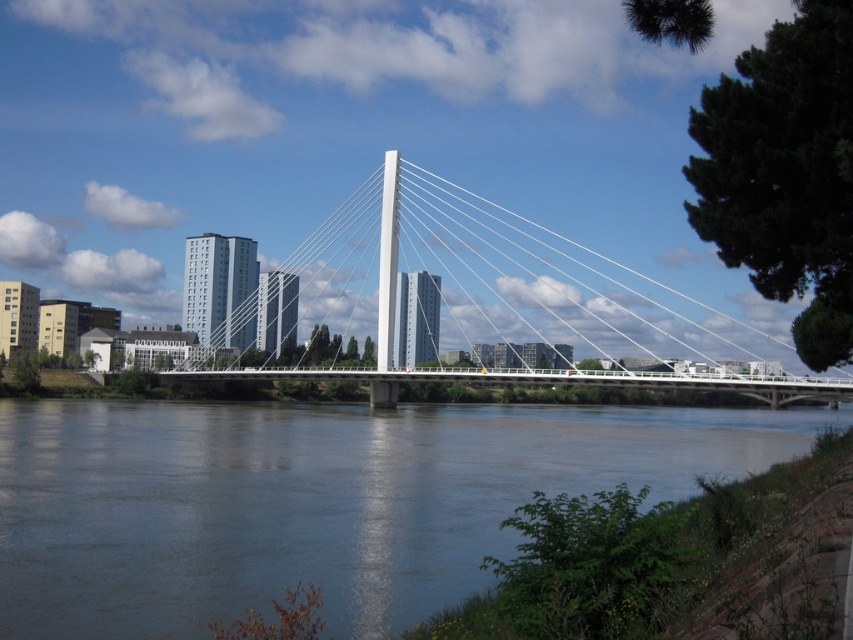
You are a drone operator tasked with capturing aerial footage of the dark blue water at lower center and the white metallic suspension bridge at center. Your drone has a maximum flight range of 50 meters. Can your drone safely fly from the bridge to the water without exceeding its range?

The distance between the dark blue water at lower center and the white metallic suspension bridge at center is 51.85 meters, which exceeds the drone operator drone maximum flight range of 50 meters. Therefore, the drone cannot safely fly from the bridge to the water without exceeding its range.

You are a photographer planning to capture the entire view of the dark blue water at lower center and the white metallic suspension bridge at center in a single shot. Considering their widths, which object will require you to adjust your camera angle to ensure both fit in the frame?

The white metallic suspension bridge at center has a greater width than the dark blue water at lower center, so you will need to adjust your camera angle to accommodate its larger size to ensure both fit in the frame.